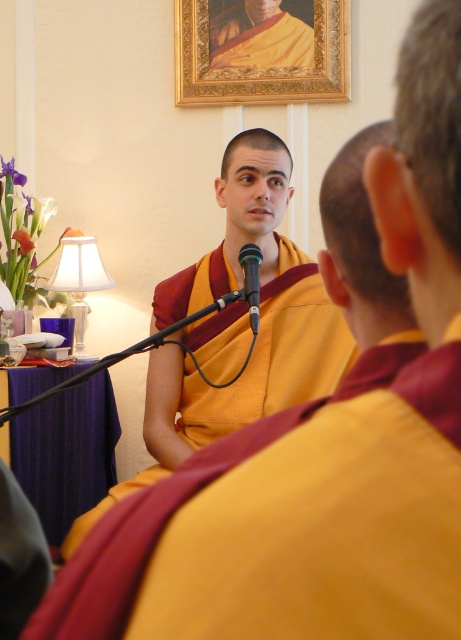
Question: Which of the following is the farthest from the observer?

Choices:
 (A) (260, 38)
 (B) (248, 253)
 (C) (265, 380)

Answer: (A)

Question: Can you confirm if goldframed picture at upper center is thinner than black plastic microphone at center?

Choices:
 (A) no
 (B) yes

Answer: (A)

Question: Does yellow silk robe at center have a larger size compared to white fabric lampshade at left?

Choices:
 (A) yes
 (B) no

Answer: (B)

Question: Which is nearer to the black plastic microphone at center?

Choices:
 (A) white fabric lampshade at left
 (B) goldframed picture at upper center
 (C) yellow silk robe at center
 (D) matte yellow and maroon robe at center

Answer: (D)

Question: Based on their relative distances, which object is farther from the white fabric lampshade at left?

Choices:
 (A) yellow silk robe at center
 (B) goldframed picture at upper center
 (C) matte yellow and maroon robe at center
 (D) black plastic microphone at center

Answer: (D)

Question: Is goldframed picture at upper center closer to the viewer compared to white fabric lampshade at left?

Choices:
 (A) no
 (B) yes

Answer: (A)